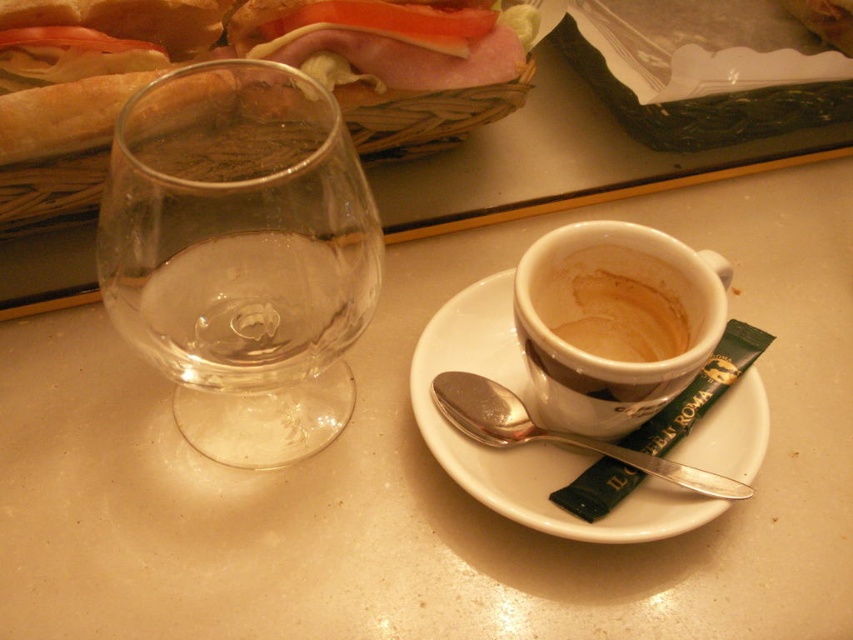
You are a barista setting up a table for a customer. You have a white ceramic saucer at center and a brown matte cup at center right. Where should you place the cup relative to the saucer to match the image?

The brown matte cup at center right should be placed to the right of the white ceramic saucer at center, as the saucer is positioned on the left side of the cup in the image.

You are a barista preparing a customer order. You need to place the brown matte cup at center right onto the white ceramic saucer at center. Is the saucer large enough to hold the cup without it falling off?

The white ceramic saucer at center is positioned under the brown matte cup at center right, indicating that the saucer is large enough to securely hold the cup without it falling off.

From the picture: You are a barista preparing a drink and need to place the silver metallic spoon at upper center on top of the white ceramic saucer at center. Will the spoon fit on the saucer without hanging over the edges?

The white ceramic saucer at center has a greater height compared to the silver metallic spoon at upper center. Since the saucer is taller, the spoon will fit on it without hanging over the edges.